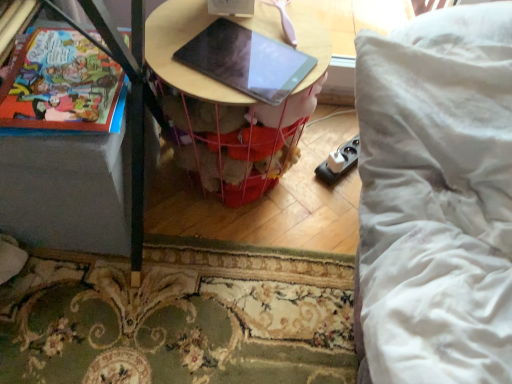
The image size is (512, 384). Find the location of `matte paper comic book at left`. matte paper comic book at left is located at coordinates (62, 85).

Is wooden table at center oriented away from matte paper comic book at left?

That's not correct — wooden table at center is not looking away from matte paper comic book at left.

Considering the sizes of objects wooden table at center and matte paper comic book at left in the image provided, who is shorter, wooden table at center or matte paper comic book at left?

matte paper comic book at left is shorter.

Considering the sizes of objects wooden table at center and matte black tablet at center in the image provided, who is thinner, wooden table at center or matte black tablet at center?

Thinner between the two is matte black tablet at center.

Can you confirm if wooden table at center is positioned to the right of matte black tablet at center?

Incorrect, wooden table at center is not on the right side of matte black tablet at center.

Considering the sizes of objects wooden table at center and matte black tablet at center in the image provided, who is shorter, wooden table at center or matte black tablet at center?

With less height is matte black tablet at center.

Is matte black tablet at center facing towards matte paper comic book at left?

No, matte black tablet at center is not oriented towards matte paper comic book at left.

Find the location of a particular element. laptop behind the matte paper comic book at left is located at coordinates (246, 61).

Who is more distant, matte black tablet at center or matte paper comic book at left?

matte black tablet at center is more distant.

From the image's perspective, is matte black tablet at center positioned above or below matte paper comic book at left?

Based on their image positions, matte black tablet at center is located above matte paper comic book at left.

Considering the relative sizes of matte paper comic book at left and wooden table at center in the image provided, is matte paper comic book at left smaller than wooden table at center?

Yes, matte paper comic book at left is smaller than wooden table at center.

Is wooden table at center at the back of matte paper comic book at left?

No, matte paper comic book at left is not facing away from wooden table at center.

Does matte paper comic book at left have a lesser width compared to wooden table at center?

Yes, matte paper comic book at left is thinner than wooden table at center.

Based on their sizes in the image, would you say matte paper comic book at left is bigger or smaller than matte black tablet at center?

Clearly, matte paper comic book at left is larger in size than matte black tablet at center.

Locate an element on the screen. The image size is (512, 384). laptop that is above the matte paper comic book at left (from the image's perspective) is located at coordinates (246, 61).

Choose the correct answer: Is matte paper comic book at left inside matte black tablet at center or outside it?

matte paper comic book at left cannot be found inside matte black tablet at center.

Consider the image. Who is shorter, matte black tablet at center or wooden table at center?

matte black tablet at center.

From the image's perspective, which is above, matte black tablet at center or wooden table at center?

matte black tablet at center is shown above in the image.

Is the depth of matte black tablet at center less than that of wooden table at center?

That is True.

From a real-world perspective, does matte black tablet at center stand above wooden table at center?

Yes, from a real-world perspective, matte black tablet at center is above wooden table at center.

Image resolution: width=512 pixels, height=384 pixels. I want to click on table behind the matte paper comic book at left, so click(x=234, y=91).

In order to click on laptop above the wooden table at center (from a real-world perspective) in this screenshot , I will do `click(246, 61)`.

Based on their spatial positions, is matte black tablet at center or matte paper comic book at left closer to wooden table at center?

matte black tablet at center is closer to wooden table at center.

From the image, which object appears to be farther from matte paper comic book at left, wooden table at center or matte black tablet at center?

wooden table at center is further to matte paper comic book at left.

Based on their spatial positions, is matte black tablet at center or wooden table at center closer to matte paper comic book at left?

The object closer to matte paper comic book at left is matte black tablet at center.

From the image, which object appears to be nearer to wooden table at center, matte paper comic book at left or matte black tablet at center?

matte black tablet at center lies closer to wooden table at center than the other object.

From the picture: Considering their positions, is wooden table at center positioned closer to matte black tablet at center than matte paper comic book at left?

Based on the image, wooden table at center appears to be nearer to matte black tablet at center.

When comparing their distances from matte black tablet at center, does matte paper comic book at left or wooden table at center seem further?

matte paper comic book at left.

Find the location of a particular element. table between matte paper comic book at left and matte black tablet at center from left to right is located at coordinates (234, 91).